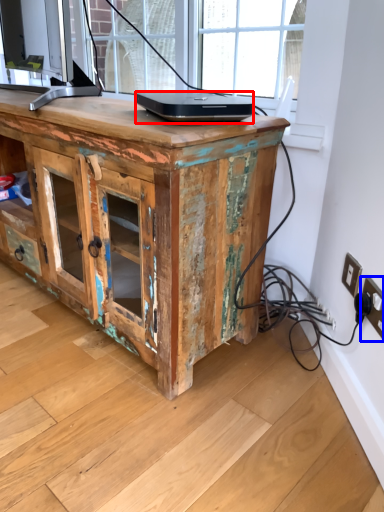
Question: Among these objects, which one is nearest to the camera, laptop (highlighted by a red box) or electric outlet (highlighted by a blue box)?

Choices:
 (A) laptop
 (B) electric outlet

Answer: (B)